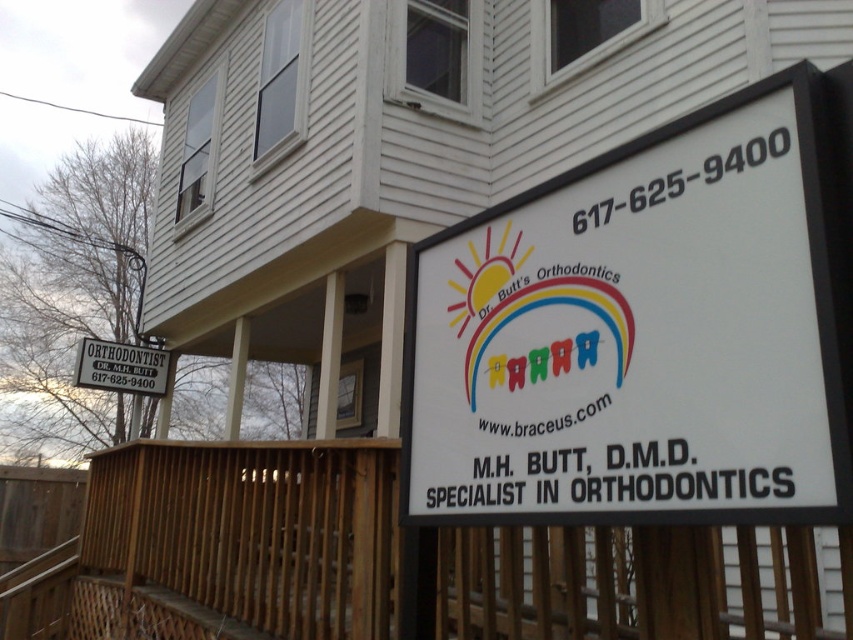
Does white plastic sign at right come in front of white plastic sign at upper left?

Yes, white plastic sign at right is in front of white plastic sign at upper left.

Can you confirm if white plastic sign at right is taller than white plastic sign at upper left?

Yes.

The height and width of the screenshot is (640, 853). I want to click on white plastic sign at right, so click(647, 330).

Where is `white plastic sign at right`? Image resolution: width=853 pixels, height=640 pixels. white plastic sign at right is located at coordinates (647, 330).

Which of these two, white plastic sign at right or wooden at lower center, stands taller?

white plastic sign at right is taller.

Does white plastic sign at right have a smaller size compared to wooden at lower center?

Yes, white plastic sign at right is smaller than wooden at lower center.

Which is behind, point (515, 406) or point (177, 476)?

Point (177, 476)

At what (x,y) coordinates should I click in order to perform the action: click on white plastic sign at right. Please return your answer as a coordinate pair (x, y). Image resolution: width=853 pixels, height=640 pixels. Looking at the image, I should click on (647, 330).

Based on the photo, is wooden at lower center to the right of white plastic sign at upper left from the viewer's perspective?

Yes, wooden at lower center is to the right of white plastic sign at upper left.

Does wooden at lower center lie in front of white plastic sign at upper left?

That is True.

Is point (143, 545) farther from camera compared to point (94, 364)?

No, it is in front of (94, 364).

Find the location of `wooden at lower center`. wooden at lower center is located at coordinates (227, 544).